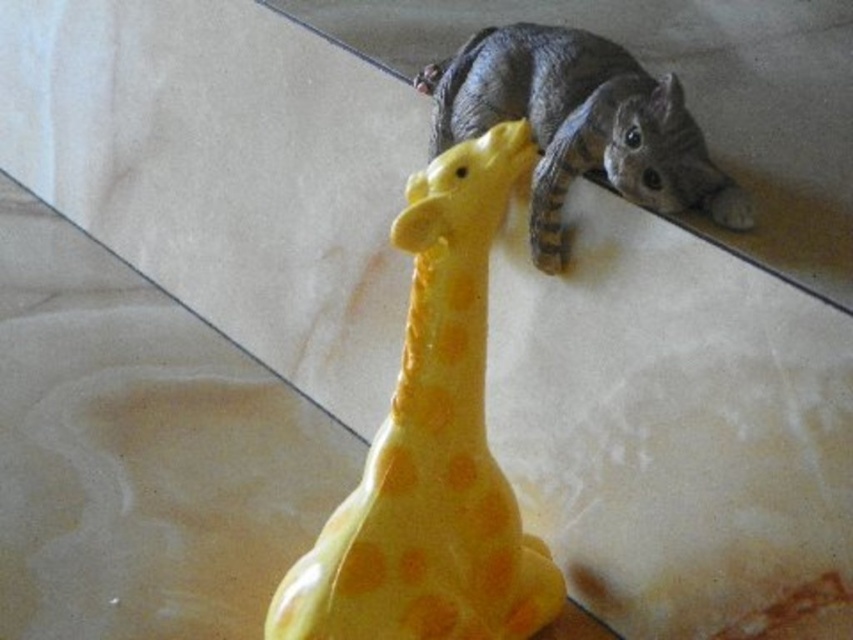
You are a photographer trying to capture a clear shot of the gray fur cat at upper right. However, the yellow rubber giraffe at center is blocking your view. Can you adjust your position to take the photo without moving any objects?

The yellow rubber giraffe at center is positioned under the gray fur cat at upper right, so moving your camera position slightly upwards might allow you to capture the gray fur cat at upper right without obstruction from the giraffe.

Looking at this image, you are standing in a room with a yellow toy giraffe and a gray cat. You want to place a small sticker exactly halfway between the two points marked as point (424, 515) and point (521, 109). Will the sticker be closer to the yellow toy giraffe or the gray cat?

The sticker placed exactly halfway between point (424, 515) and point (521, 109) will be closer to the gray cat because point (424, 515) is closer to the viewer than point (521, 109), making the midpoint lean towards the farther point.

You are a child who wants to place a small toy car between the yellow rubber giraffe at center and the gray fur cat at upper right. Can you fit the toy car between them without moving either object?

The yellow rubber giraffe at center is much taller than the gray fur cat at upper right, but the question is about fitting a toy car between them horizontally. The description does not provide information about the horizontal distance between the two objects, so it is impossible to determine if the toy car can fit between them based on the given details.